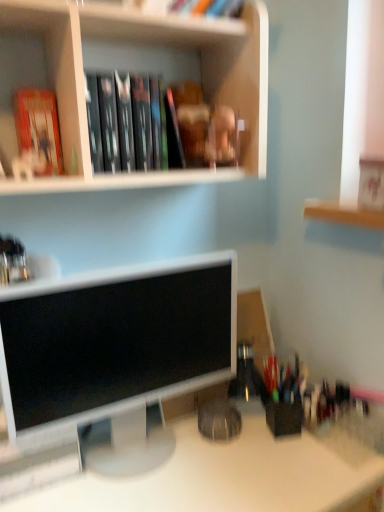
What are the coordinates of `hardcover book at upper left` in the screenshot? It's located at (38, 130).

Locate an element on the screen. hardcover books at upper center is located at coordinates (132, 124).

Image resolution: width=384 pixels, height=512 pixels. What are the coordinates of `white glossy desk at center` in the screenshot? It's located at (223, 477).

Considering the sizes of objects hardcover books at upper center and white matte bookshelf at upper center in the image provided, who is taller, hardcover books at upper center or white matte bookshelf at upper center?

With more height is white matte bookshelf at upper center.

This screenshot has width=384, height=512. Find the location of `shelf in front of the hardcover books at upper center`. shelf in front of the hardcover books at upper center is located at coordinates (138, 70).

Considering the sizes of hardcover books at upper center and white matte bookshelf at upper center in the image, is hardcover books at upper center wider or thinner than white matte bookshelf at upper center?

hardcover books at upper center is thinner than white matte bookshelf at upper center.

Is hardcover books at upper center placed right next to white matte bookshelf at upper center?

No, hardcover books at upper center is not with white matte bookshelf at upper center.

Where is `paperback book above the white glossy desk at center (from a real-world perspective)`? paperback book above the white glossy desk at center (from a real-world perspective) is located at coordinates pos(38,130).

Which object is thinner, white glossy desk at center or hardcover book at upper left?

hardcover book at upper left.

From a real-world perspective, is white glossy desk at center below hardcover book at upper left?

Yes, from a real-world perspective, white glossy desk at center is beneath hardcover book at upper left.

Is white glossy desk at center to the right of hardcover book at upper left from the viewer's perspective?

Yes, white glossy desk at center is to the right of hardcover book at upper left.

Considering the relative sizes of hardcover books at upper center and matte white monitor at center in the image provided, is hardcover books at upper center bigger than matte white monitor at center?

Actually, hardcover books at upper center might be smaller than matte white monitor at center.

Is hardcover books at upper center facing towards matte white monitor at center?

No, hardcover books at upper center is not facing towards matte white monitor at center.

This screenshot has width=384, height=512. I want to click on computer monitor below the hardcover books at upper center (from a real-world perspective), so click(113, 343).

Does hardcover book at upper left touch hardcover books at upper center?

No, hardcover book at upper left is not with hardcover books at upper center.

Considering their positions, is hardcover book at upper left located in front of or behind hardcover books at upper center?

Visually, hardcover book at upper left is located in front of hardcover books at upper center.

Considering the sizes of objects hardcover book at upper left and hardcover books at upper center in the image provided, who is wider, hardcover book at upper left or hardcover books at upper center?

With larger width is hardcover books at upper center.

Which of these two, hardcover book at upper left or hardcover books at upper center, stands shorter?

hardcover book at upper left.

Can white glossy desk at center be found inside white matte bookshelf at upper center?

No, white glossy desk at center is not a part of white matte bookshelf at upper center.

In the scene shown: Does white matte bookshelf at upper center have a lesser width compared to white glossy desk at center?

Indeed, white matte bookshelf at upper center has a lesser width compared to white glossy desk at center.

From the image's perspective, does white matte bookshelf at upper center appear higher than white glossy desk at center?

→ Correct, white matte bookshelf at upper center appears higher than white glossy desk at center in the image.

Is white matte bookshelf at upper center positioned with its back to white glossy desk at center?

No, white matte bookshelf at upper center's orientation is not away from white glossy desk at center.

Could you tell me if hardcover books at upper center is facing hardcover book at upper left?

No, hardcover books at upper center is not oriented towards hardcover book at upper left.

Considering the points (111, 138) and (16, 106), which point is in front, point (111, 138) or point (16, 106)?

The point (111, 138) is in front.

Visually, is hardcover books at upper center positioned to the left or to the right of hardcover book at upper left?

Clearly, hardcover books at upper center is on the right of hardcover book at upper left in the image.

Is hardcover book at upper left located within hardcover books at upper center?

No, hardcover book at upper left is not a part of hardcover books at upper center.

Which is behind, matte white monitor at center or white matte bookshelf at upper center?

matte white monitor at center is behind.

You are a GUI agent. You are given a task and a screenshot of the screen. Output one action in this format:
    pyautogui.click(x=<x>, y=<y>)
    Task: Click on the computer monitor to the left of white matte bookshelf at upper center
    
    Given the screenshot: What is the action you would take?
    pyautogui.click(x=113, y=343)

Is matte white monitor at center oriented towards white matte bookshelf at upper center?

No, matte white monitor at center is not turned towards white matte bookshelf at upper center.

Is matte white monitor at center wider or thinner than white matte bookshelf at upper center?

In the image, matte white monitor at center appears to be more narrow than white matte bookshelf at upper center.

Locate an element on the screen. shelf on the right of hardcover books at upper center is located at coordinates (138, 70).

Identify the location of desk directly beneath the hardcover book at upper left (from a real-world perspective). The height and width of the screenshot is (512, 384). (223, 477).

Considering their positions, is hardcover books at upper center positioned further to matte white monitor at center than white matte bookshelf at upper center?

white matte bookshelf at upper center.

Looking at the image, which one is located further to hardcover book at upper left, matte white monitor at center or white glossy desk at center?

white glossy desk at center.

From the image, which object appears to be farther from white glossy desk at center, hardcover book at upper left or hardcover books at upper center?

Based on the image, hardcover book at upper left appears to be further to white glossy desk at center.

When comparing their distances from hardcover book at upper left, does white glossy desk at center or white matte bookshelf at upper center seem closer?

white matte bookshelf at upper center.

Estimate the real-world distances between objects in this image. Which object is further from hardcover books at upper center, white glossy desk at center or white matte bookshelf at upper center?

The object further to hardcover books at upper center is white glossy desk at center.

Which object lies further to the anchor point white matte bookshelf at upper center, hardcover books at upper center or hardcover book at upper left?

The object further to white matte bookshelf at upper center is hardcover book at upper left.

Estimate the real-world distances between objects in this image. Which object is further from white matte bookshelf at upper center, white glossy desk at center or hardcover book at upper left?

white glossy desk at center.

Considering their positions, is matte white monitor at center positioned closer to white matte bookshelf at upper center than hardcover book at upper left?

Based on the image, hardcover book at upper left appears to be nearer to white matte bookshelf at upper center.

What are the coordinates of `paperback book between white matte bookshelf at upper center and matte white monitor at center from top to bottom` in the screenshot? It's located at (38, 130).

I want to click on paperback book between hardcover books at upper center and white glossy desk at center in the up-down direction, so click(x=38, y=130).

Where is `book between white matte bookshelf at upper center and matte white monitor at center vertically`? book between white matte bookshelf at upper center and matte white monitor at center vertically is located at coordinates (132, 124).

You are a GUI agent. You are given a task and a screenshot of the screen. Output one action in this format:
    pyautogui.click(x=<x>, y=<y>)
    Task: Click on the computer monitor between white matte bookshelf at upper center and white glossy desk at center from top to bottom
    Image resolution: width=384 pixels, height=512 pixels.
    Given the screenshot: What is the action you would take?
    pyautogui.click(x=113, y=343)